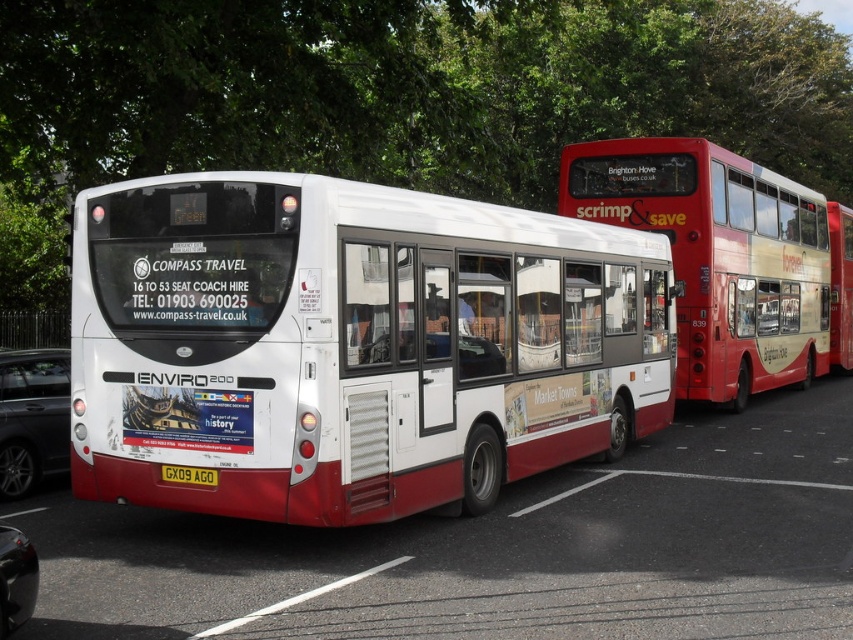
Question: Considering the real-world distances, which object is closest to the red matte double-decker bus at right?

Choices:
 (A) white glossy bus at center
 (B) matte white bus at center
 (C) shiny black car at lower left
 (D) yellow metallic license plate at center

Answer: (B)

Question: Observing the image, what is the correct spatial positioning of white matte bus at center in reference to shiny black car at lower left?

Choices:
 (A) left
 (B) right

Answer: (B)

Question: Does matte white bus at center have a smaller size compared to black asphalt at lower center?

Choices:
 (A) no
 (B) yes

Answer: (A)

Question: Which point is farther from the camera taking this photo?

Choices:
 (A) (831, 205)
 (B) (827, 275)

Answer: (A)

Question: Which point appears closest to the camera in this image?

Choices:
 (A) (4, 616)
 (B) (184, 413)
 (C) (20, 387)
 (D) (196, 474)

Answer: (A)

Question: Does white matte bus at center appear on the right side of yellow metallic license plate at center?

Choices:
 (A) no
 (B) yes

Answer: (B)